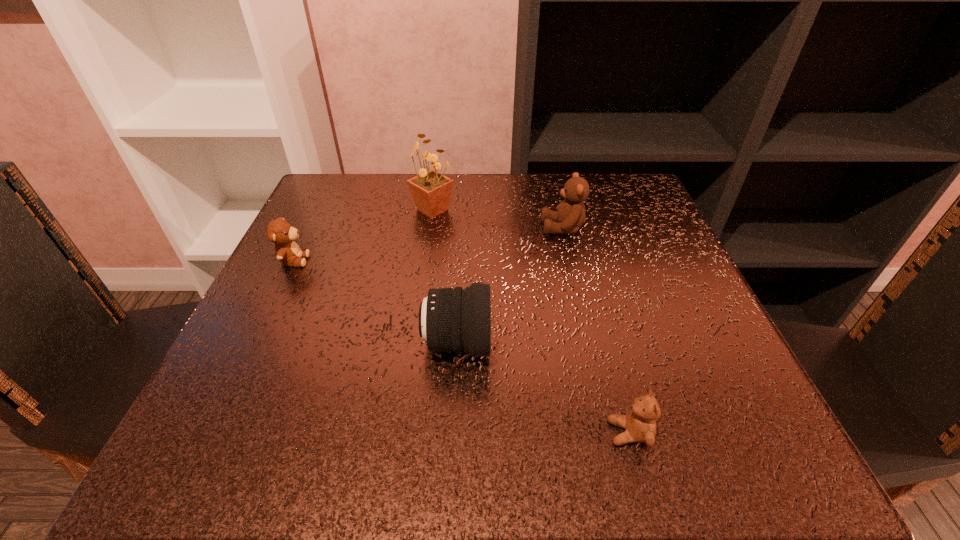
The height and width of the screenshot is (540, 960). What are the coordinates of `the tallest object` in the screenshot? It's located at (431, 191).

Image resolution: width=960 pixels, height=540 pixels. In order to click on the tallest teddy bear in this screenshot , I will do `click(570, 215)`.

Where is `telephoto lens`? telephoto lens is located at coordinates (458, 319).

Find the location of a particular element. the third farthest object is located at coordinates (279, 231).

Image resolution: width=960 pixels, height=540 pixels. Find the location of `the second farthest teddy bear`. the second farthest teddy bear is located at coordinates (279, 231).

The width and height of the screenshot is (960, 540). In order to click on the nearest teddy bear in this screenshot , I will do `click(640, 424)`.

Image resolution: width=960 pixels, height=540 pixels. I want to click on vacant space situated 0.380m at the front of the tallest object with flowers visible, so click(410, 368).

This screenshot has height=540, width=960. I want to click on free spot located 0.290m on the face of the farthest teddy bear, so click(404, 228).

This screenshot has height=540, width=960. I want to click on blank area located on the face of the farthest teddy bear, so click(x=414, y=228).

This screenshot has height=540, width=960. In order to click on free region located on the face of the farthest teddy bear in this screenshot , I will do `click(400, 228)`.